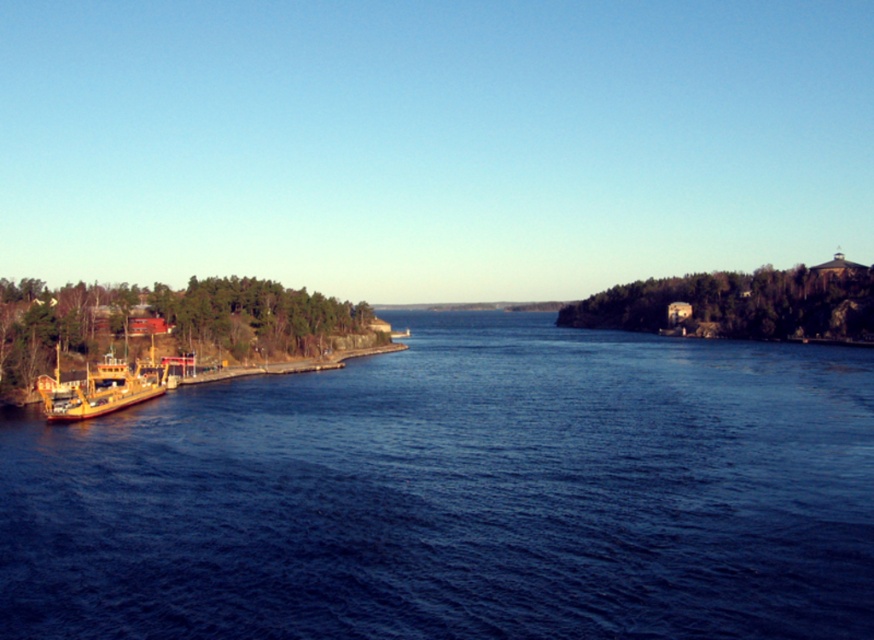
Is blue water at center positioned behind yellow matte boat at left?

No, blue water at center is closer to the viewer.

Which is behind, point (209, 564) or point (108, 380)?

Positioned behind is point (108, 380).

Locate an element on the screen. This screenshot has height=640, width=874. blue water at center is located at coordinates (459, 496).